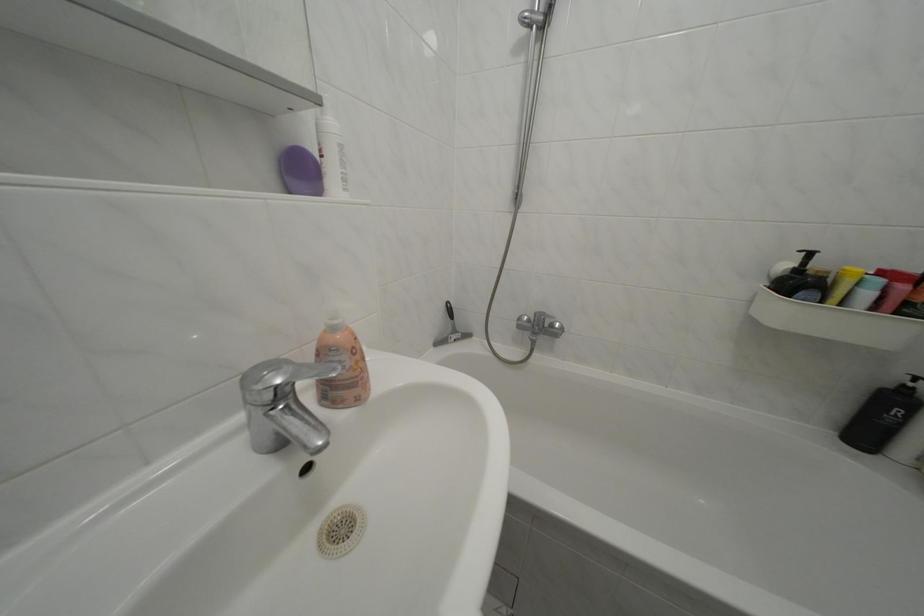
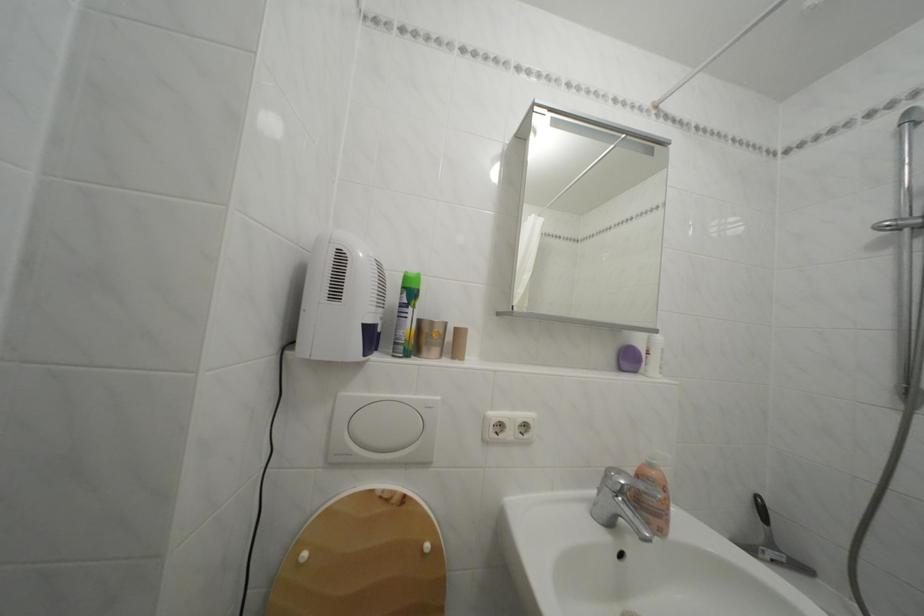
Looking at this image, the images are taken continuously from a first-person perspective. In which direction is your viewpoint rotating?

The camera rotated toward left-up.